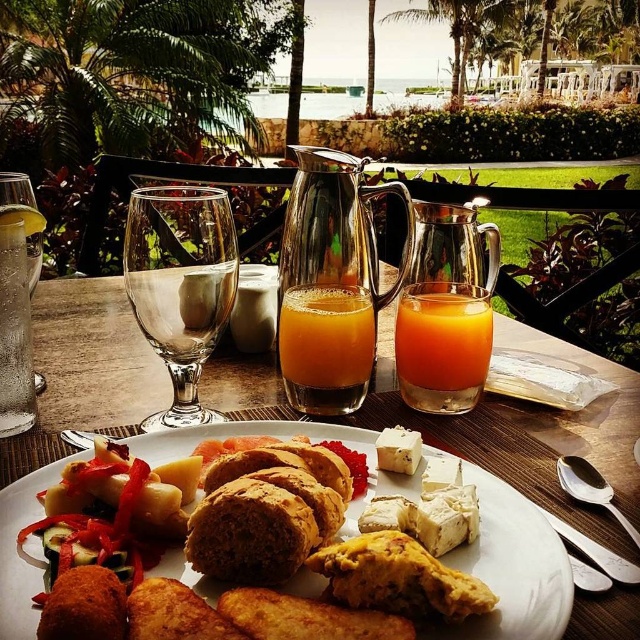
Question: Is orange liquid at center smaller than satin silver spoon at lower right?

Choices:
 (A) no
 (B) yes

Answer: (A)

Question: Which object is farther from the camera taking this photo?

Choices:
 (A) golden brown bread at center
 (B) silver spoon at upper right

Answer: (B)

Question: Is transparent glass wine glass at center to the right of silver spoon at upper right from the viewer's perspective?

Choices:
 (A) yes
 (B) no

Answer: (B)

Question: Which object is farther from the camera taking this photo?

Choices:
 (A) transparent glass wine glass at center
 (B) metallic glass pitcher at center
 (C) orange liquid at center

Answer: (C)

Question: Which point is closer to the camera?

Choices:
 (A) (285, 388)
 (B) (584, 538)

Answer: (B)

Question: Observing the image, what is the correct spatial positioning of golden brown bread at center in reference to silver spoon at upper right?

Choices:
 (A) left
 (B) right

Answer: (A)